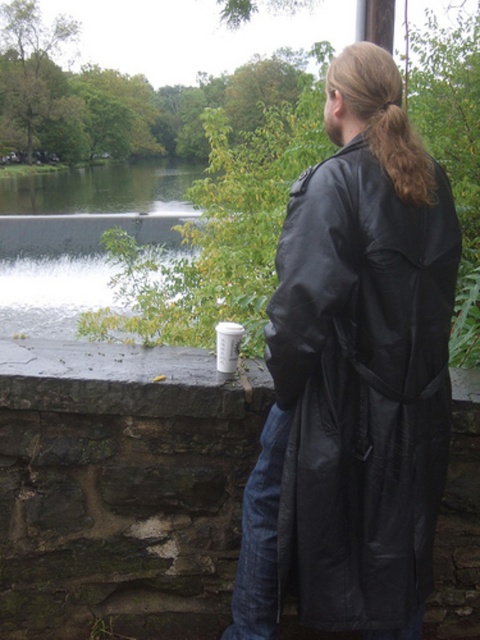
Looking at this image, you are a photographer capturing the scene of a person by the water. You notice the black leather jacket at upper right and the brown silky hair at upper right. Which object is positioned closer to the camera lens?

The black leather jacket at upper right is closer to the viewer than the brown silky hair at upper right, so the black leather jacket at upper right would be the one closer to the camera lens.

You are a photographer capturing the scene of a person by the water. You need to frame the black leather jacket at upper right and brown silky hair at upper right in your shot. Which object should you prioritize in terms of width to ensure proper framing?

The black leather jacket at upper right has a greater width than the brown silky hair at upper right, so you should prioritize framing the black leather jacket at upper right due to its larger width to ensure proper composition.

You are a delivery person who needs to place a 1.5 meter long package between the black leather jacket at upper right and the stone wall. Is there enough space?

The distance between the black leather jacket at upper right and the stone wall is 1.60 meters, so yes, the 1.5 meter long package can fit between them with 10 centimeters of space remaining.